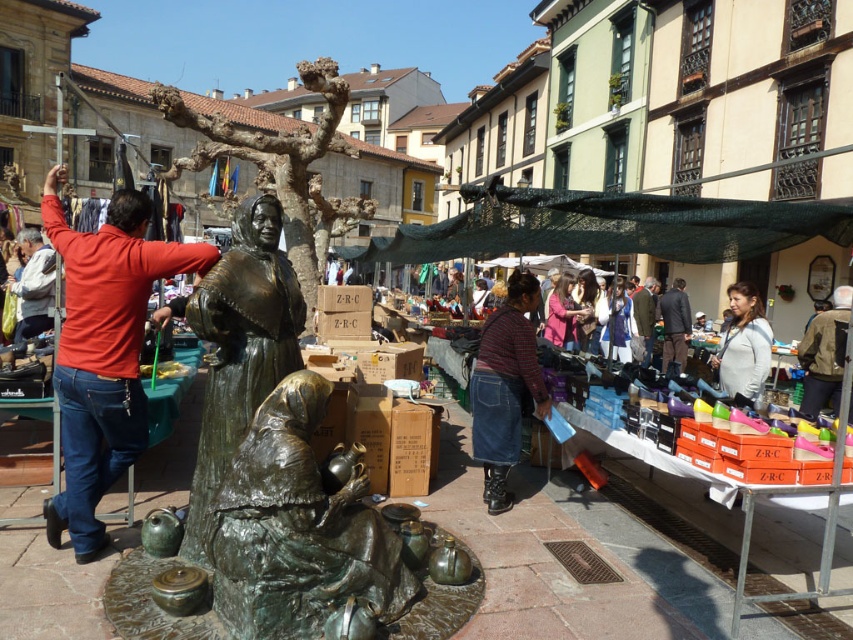
Is point (213, 412) in front of point (517, 292)?

Yes, point (213, 412) is closer to viewer.

In order to click on bronze statue at center in this screenshot , I will do click(239, 346).

Who is lower down, khaki fabric jacket at lower right or dark brown suit at center?

Positioned lower is khaki fabric jacket at lower right.

Can you confirm if khaki fabric jacket at lower right is taller than dark brown suit at center?

No, khaki fabric jacket at lower right is not taller than dark brown suit at center.

At what (x,y) coordinates should I click in order to perform the action: click on khaki fabric jacket at lower right. Please return your answer as a coordinate pair (x, y). The height and width of the screenshot is (640, 853). Looking at the image, I should click on (824, 355).

You are a GUI agent. You are given a task and a screenshot of the screen. Output one action in this format:
    pyautogui.click(x=<x>, y=<y>)
    Task: Click on the khaki fabric jacket at lower right
    This screenshot has width=853, height=640.
    Given the screenshot: What is the action you would take?
    coord(824,355)

Does red cotton shirt at left have a smaller size compared to bronze statue at center?

No.

Does red cotton shirt at left appear under bronze statue at center?

No.

Is point (134, 452) farther from camera compared to point (204, 396)?

That is True.

Find the location of `red cotton shirt at left`. red cotton shirt at left is located at coordinates (103, 352).